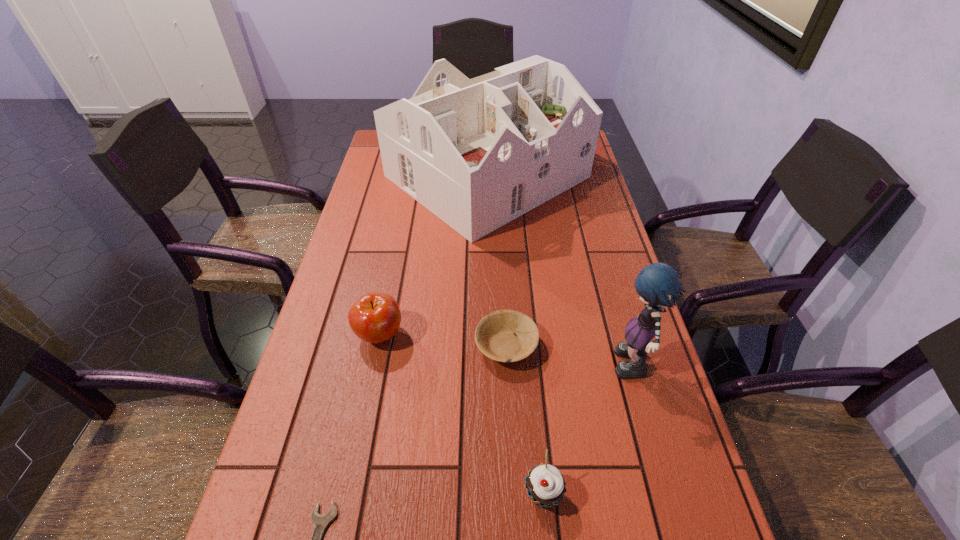
Locate an element on the screen. The image size is (960, 540). vacant region located on the left of the cupcake is located at coordinates point(348,495).

Locate an element on the screen. The image size is (960, 540). free space located 0.320m on the left of the second shortest object is located at coordinates (335, 346).

Locate an element on the screen. object that is at the far edge is located at coordinates (478, 153).

Locate an element on the screen. The height and width of the screenshot is (540, 960). dollhouse located in the left edge section of the desktop is located at coordinates (478, 153).

Locate an element on the screen. Image resolution: width=960 pixels, height=540 pixels. apple that is at the left edge is located at coordinates (375, 317).

Where is `dollhouse that is at the right edge`? This screenshot has width=960, height=540. dollhouse that is at the right edge is located at coordinates (478, 153).

Locate an element on the screen. The image size is (960, 540). rag doll that is positioned at the right edge is located at coordinates (657, 284).

At what (x,y) coordinates should I click in order to perform the action: click on object that is at the far left corner. Please return your answer as a coordinate pair (x, y). The width and height of the screenshot is (960, 540). Looking at the image, I should click on (478, 153).

At what (x,y) coordinates should I click in order to perform the action: click on object located at the far right corner. Please return your answer as a coordinate pair (x, y). Image resolution: width=960 pixels, height=540 pixels. Looking at the image, I should click on (478, 153).

In order to click on vacant area at the right edge of the desktop in this screenshot , I will do `click(563, 233)`.